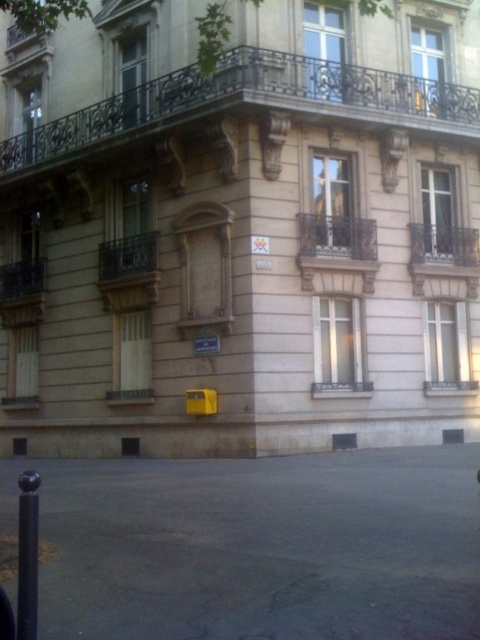
Question: Can you confirm if dark brown wrought iron balcony at upper center is positioned to the right of polished metal balcony at upper right?

Choices:
 (A) no
 (B) yes

Answer: (A)

Question: In this image, where is dark brown wrought iron balcony at upper center located relative to dark brown wrought iron balcony at left?

Choices:
 (A) right
 (B) left

Answer: (A)

Question: Can you confirm if dark brown wrought iron balcony at upper center is smaller than dark brown wrought iron balcony at center?

Choices:
 (A) yes
 (B) no

Answer: (B)

Question: Which of the following is the closest to the observer?

Choices:
 (A) dark brown wrought iron balcony at center
 (B) dark brown wrought iron balcony at upper center

Answer: (B)

Question: Which object is the farthest from the dark brown wrought iron balcony at center?

Choices:
 (A) polished metal balcony at upper right
 (B) dark brown wrought iron balcony at left
 (C) dark brown wrought iron balcony at upper center

Answer: (B)

Question: Which object is positioned closest to the dark brown wrought iron balcony at upper center?

Choices:
 (A) polished metal balcony at upper right
 (B) dark brown wrought iron balcony at center
 (C) dark brown wrought iron balcony at left

Answer: (B)